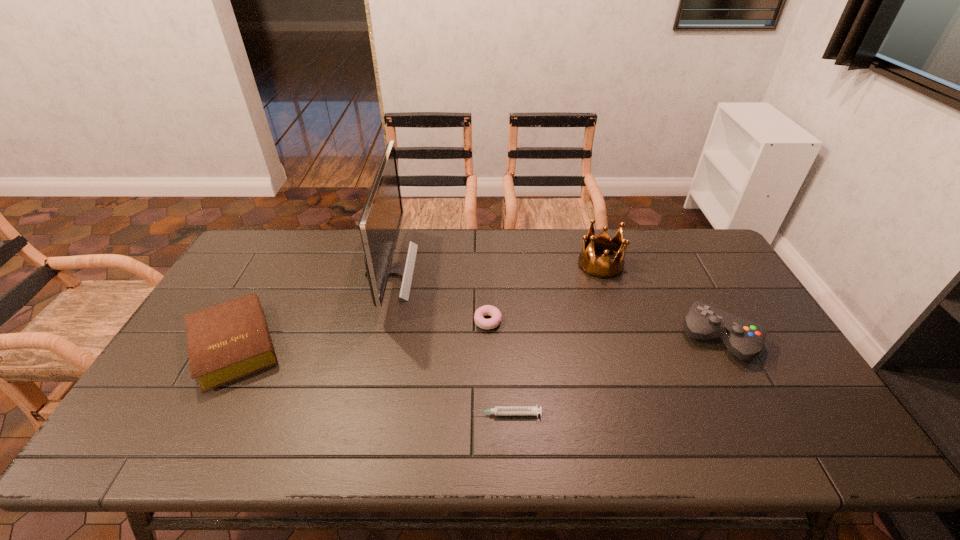
At what (x,y) coordinates should I click in order to perform the action: click on the nearest object. Please return your answer as a coordinate pair (x, y). This screenshot has height=540, width=960. Looking at the image, I should click on (498, 410).

Where is `vacant space located 0.060m on the screen side of the monitor`? This screenshot has width=960, height=540. vacant space located 0.060m on the screen side of the monitor is located at coordinates (432, 272).

You are a GUI agent. You are given a task and a screenshot of the screen. Output one action in this format:
    pyautogui.click(x=<x>, y=<y>)
    Task: Click on the vacant point located on the left of the second tallest object
    The width and height of the screenshot is (960, 540).
    Given the screenshot: What is the action you would take?
    pyautogui.click(x=542, y=264)

At what (x,y) coordinates should I click in order to perform the action: click on vacant space located 0.100m on the left of the rightmost object. Please return your answer as a coordinate pair (x, y). Looking at the image, I should click on (647, 338).

The width and height of the screenshot is (960, 540). I want to click on vacant space located 0.190m on the right of the leftmost object, so click(355, 346).

You are a GUI agent. You are given a task and a screenshot of the screen. Output one action in this format:
    pyautogui.click(x=<x>, y=<y>)
    Task: Click on the free space located 0.120m on the left of the doughnut
    
    Given the screenshot: What is the action you would take?
    pyautogui.click(x=433, y=321)

You are a GUI agent. You are given a task and a screenshot of the screen. Output one action in this format:
    pyautogui.click(x=<x>, y=<y>)
    Task: Click on the vacant area located 0.310m at the needle end of the shortest object
    
    Given the screenshot: What is the action you would take?
    pyautogui.click(x=343, y=414)

The width and height of the screenshot is (960, 540). What are the coordinates of `blank space located at the needle end of the shortest object` in the screenshot? It's located at (326, 414).

Identify the location of vacant area situated at the needle end of the shortest object. (421, 414).

Identify the location of monitor present at the far edge. The image size is (960, 540). (380, 221).